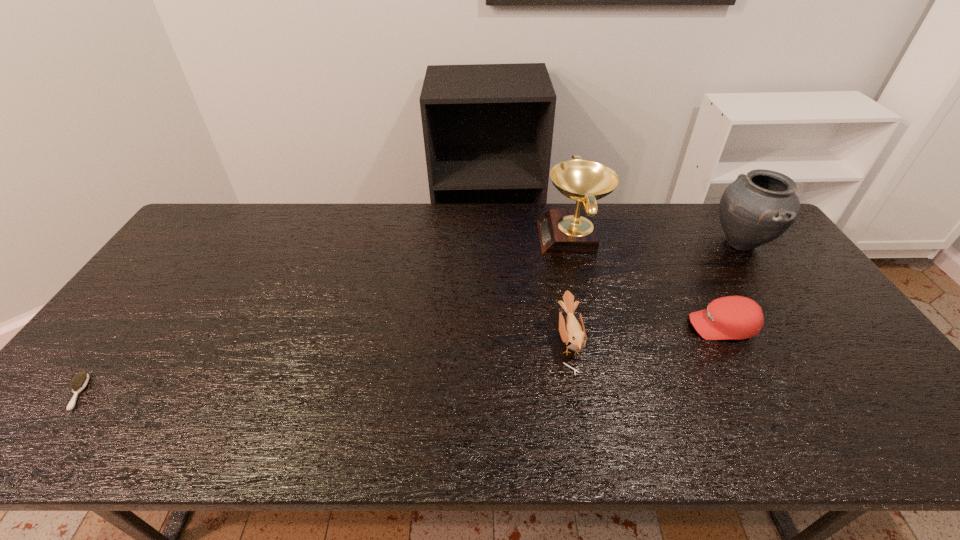
Where is `object at the left edge`? object at the left edge is located at coordinates (80, 381).

Identify the location of object present at the right edge. The image size is (960, 540). (757, 208).

This screenshot has height=540, width=960. In order to click on object that is at the far right corner in this screenshot , I will do `click(757, 208)`.

Identify the location of free space at the far edge of the desktop. The width and height of the screenshot is (960, 540). (656, 218).

In the image, there is a desktop. What are the coordinates of `vacant space at the right edge` in the screenshot? It's located at (838, 337).

This screenshot has width=960, height=540. In the image, there is a desktop. Identify the location of vacant space at the far left corner. pos(212,204).

Find the location of a particular element. The width and height of the screenshot is (960, 540). free area in between the award and the third tallest object is located at coordinates coord(570,290).

Where is `empty location between the urn and the bird`? The image size is (960, 540). empty location between the urn and the bird is located at coordinates (655, 292).

Locate an element on the screen. The height and width of the screenshot is (540, 960). vacant area between the scrubbing brush and the bird is located at coordinates coord(324,367).

You are a GUI agent. You are given a task and a screenshot of the screen. Output one action in this format:
    pyautogui.click(x=<x>, y=<y>)
    Task: Click on the free point between the urn and the award
    This screenshot has height=540, width=960.
    Given the screenshot: What is the action you would take?
    pyautogui.click(x=657, y=240)